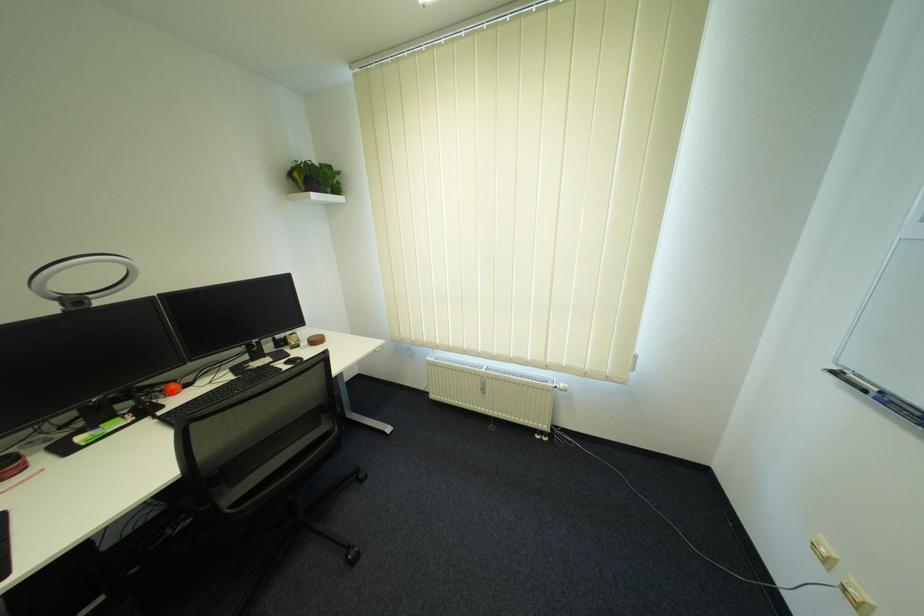
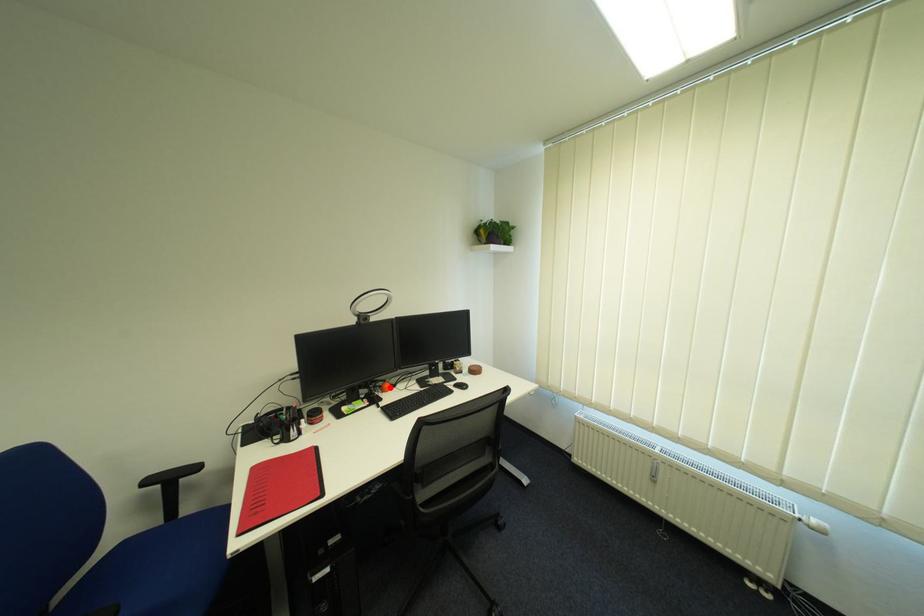
I am providing you with two images of the same scene from different viewpoints. A red point is marked on the first image and another point is marked on the second image. Is the red point in image1 aligned with the point shown in image2?

Yes